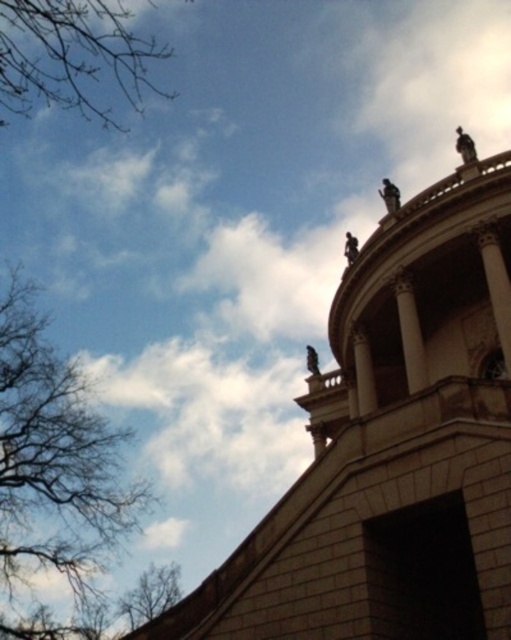
You are standing in front of the architectural structure and want to take a photo that includes both the brown leafless tree at left and the statues atop the curved facade. Given that the tree is 90.81 meters away from you, will you need to zoom out your camera to include both in the frame?

The brown leafless tree at left is 90.81 meters from the viewer, so to include both it and the statues atop the curved facade in the frame, you would need to zoom out your camera to capture the wide angle required to encompass both distant and closer subjects.

You are standing in front of the architectural structure and notice a brown leafless tree at left and some bare branches at lower left. Which of these two objects is taller?

The brown leafless tree at left is much taller than the bare branches at lower left.

You are standing in front of the architectural structure and want to take a photo that includes both the brown leafless tree at left and the bare branches at upper left. Which object should you adjust your camera angle to focus on first to ensure both are in frame?

The brown leafless tree at left is closer to you than the bare branches at upper left, so you should focus on the brown leafless tree at left first to ensure both are in frame.